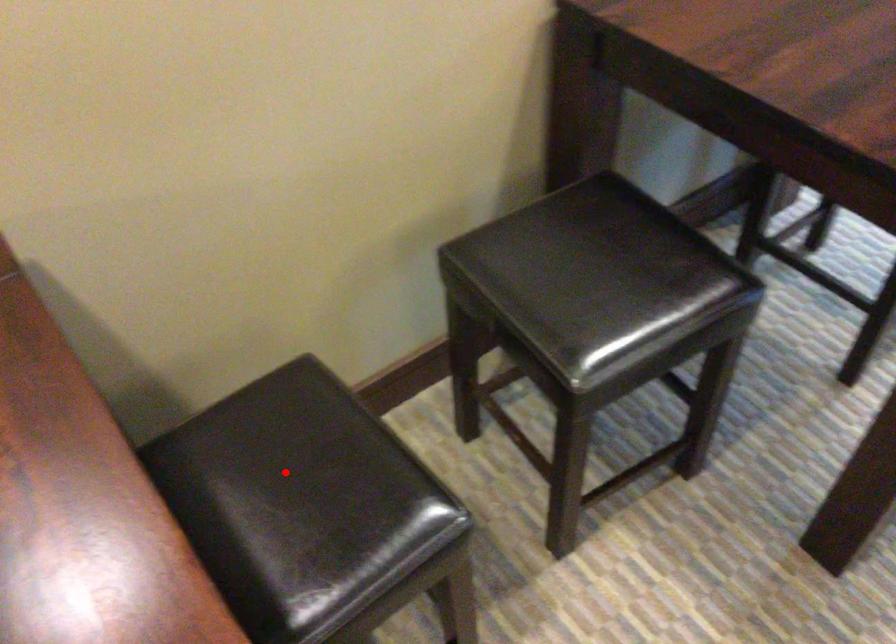
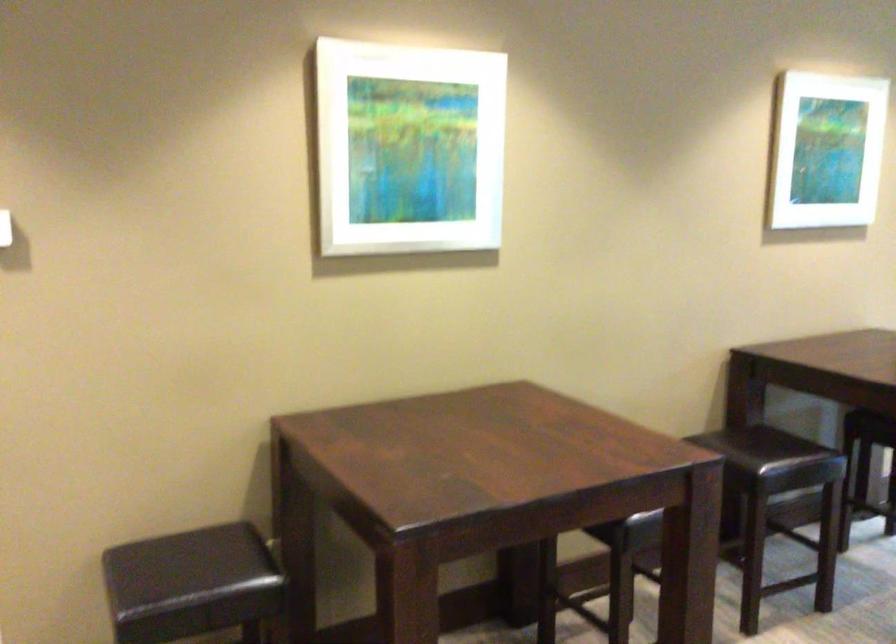
Question: I am providing you with two images of the same scene from different viewpoints. A red point is marked on the first image. At the location where the point appears in image 1, is it still visible in image 2?

Choices:
 (A) Yes
 (B) No

Answer: (B)